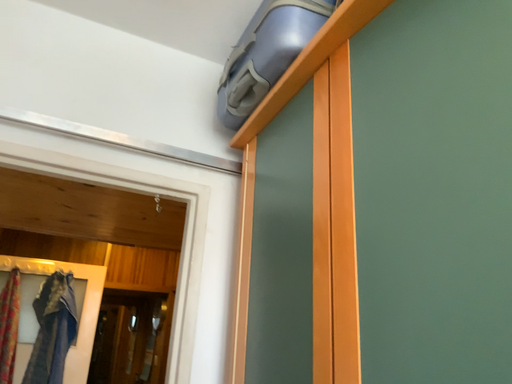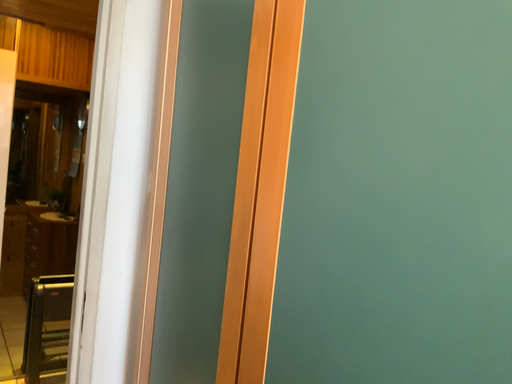
Question: How did the camera likely rotate when shooting the video?

Choices:
 (A) rotated right
 (B) rotated left

Answer: (A)